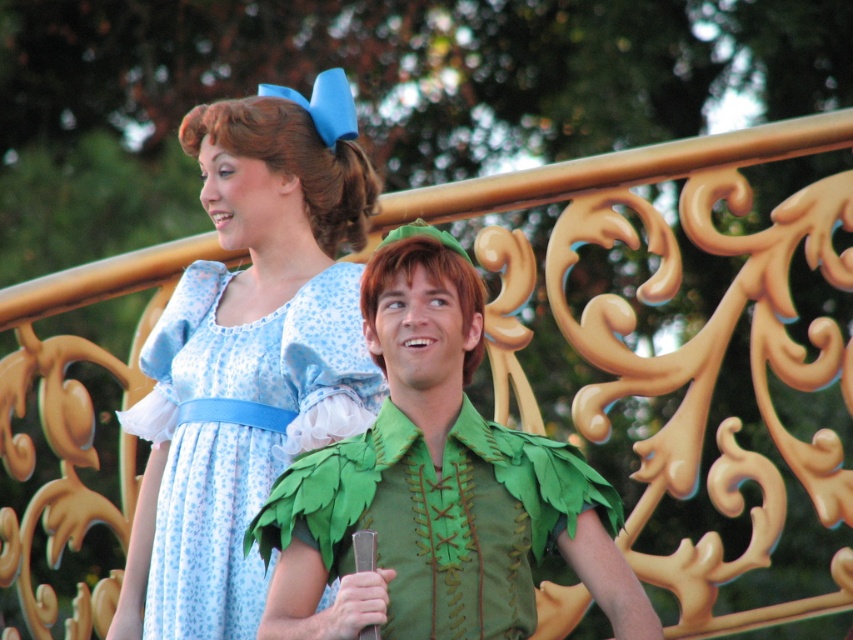
Question: Does green felt vest at center have a larger size compared to blue printed fabric dress at center?

Choices:
 (A) no
 (B) yes

Answer: (B)

Question: Can you confirm if green felt vest at center is smaller than blue printed fabric dress at center?

Choices:
 (A) yes
 (B) no

Answer: (B)

Question: Is green felt vest at center below blue printed fabric dress at center?

Choices:
 (A) yes
 (B) no

Answer: (B)

Question: Among these points, which one is nearest to the camera?

Choices:
 (A) (184, 560)
 (B) (306, 468)

Answer: (B)